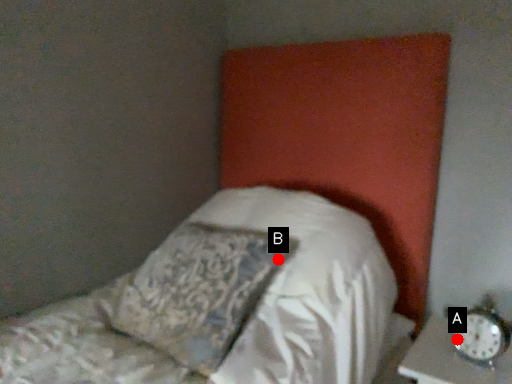
Question: Two points are circled on the image, labeled by A and B beside each circle. Which point is farther to the camera?

Choices:
 (A) A is further
 (B) B is further

Answer: (B)